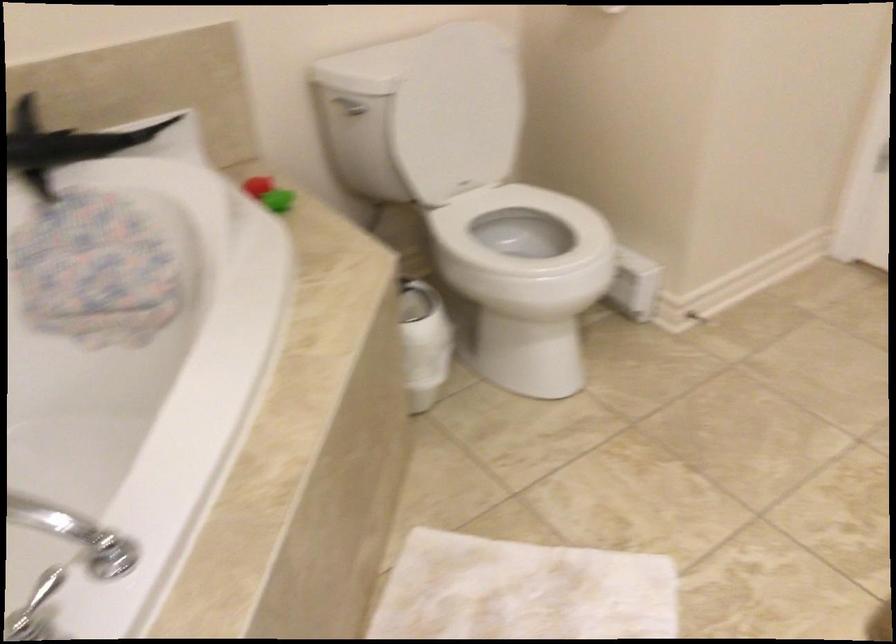
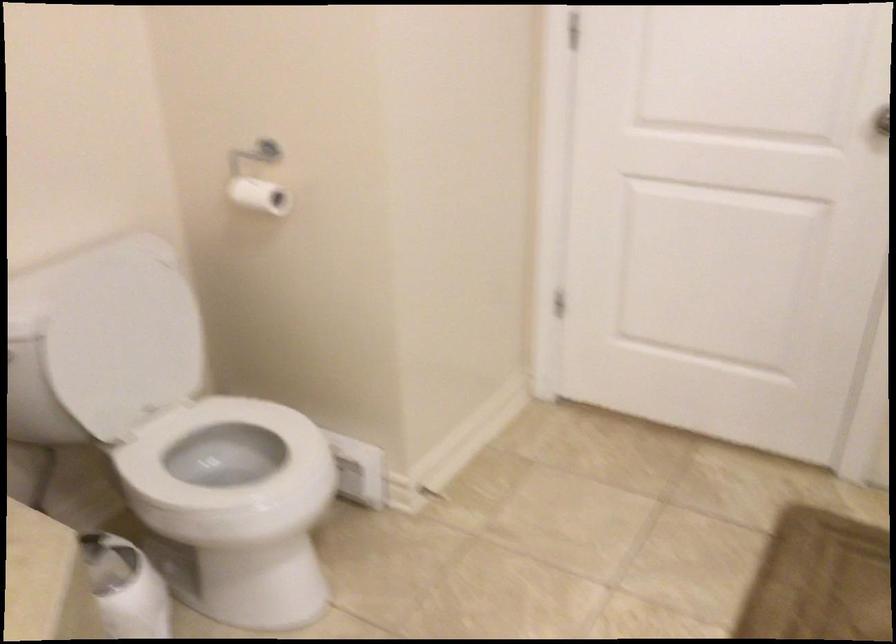
Question: The camera is either moving clockwise (left) or counter-clockwise (right) around the object. The first image is from the beginning of the video and the second image is from the end. Is the camera moving left or right when shooting the video?

Choices:
 (A) Left
 (B) Right

Answer: (A)